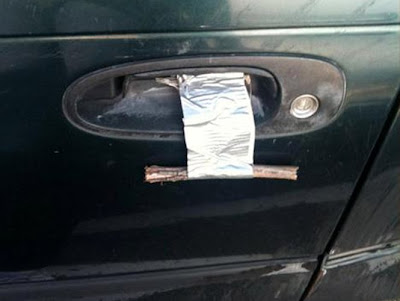
This screenshot has height=301, width=400. Find the location of `door`. door is located at coordinates [x=379, y=28], [x=376, y=27].